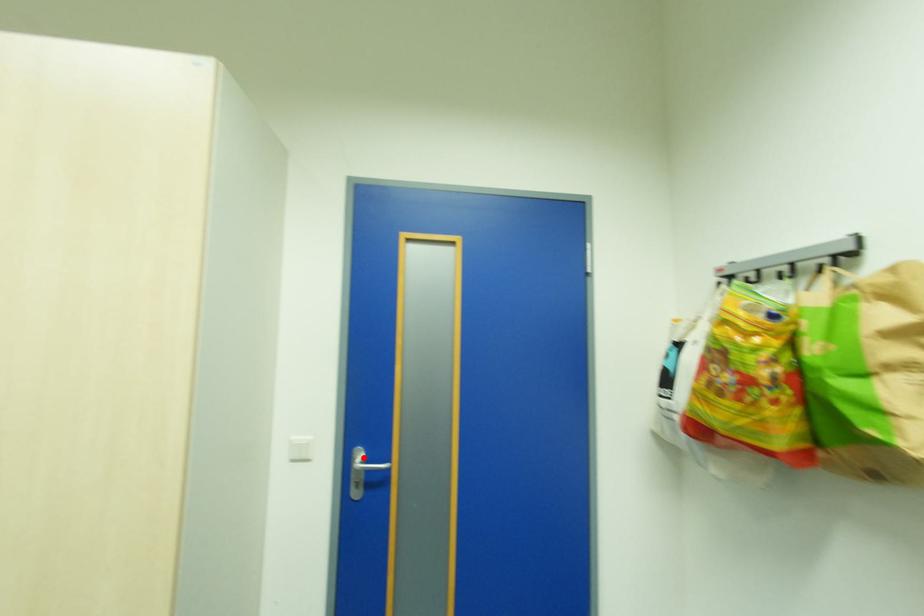
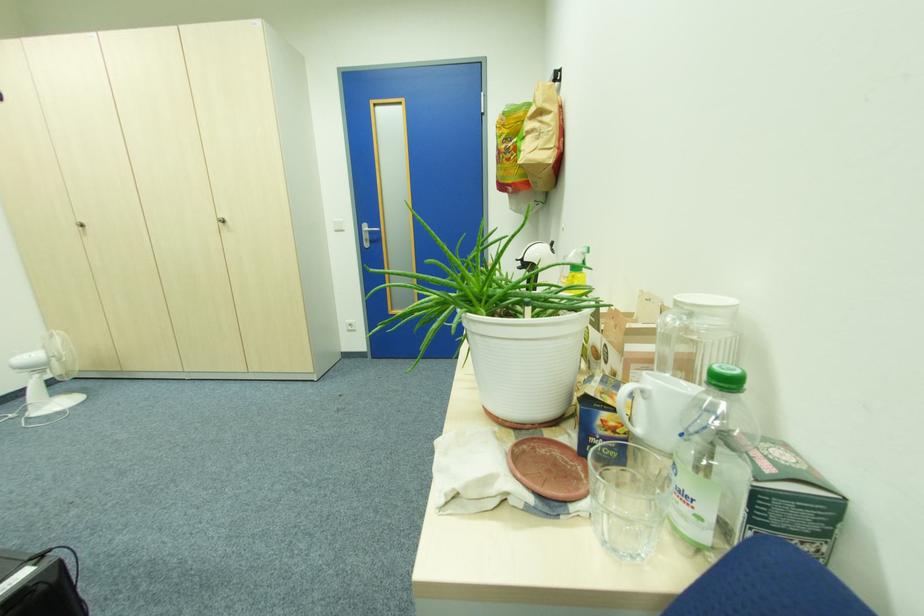
Question: I am providing you with two images of the same scene from different viewpoints. In image1, a red point is highlighted. Considering the same 3D point in image2, which of the following is correct?

Choices:
 (A) It is closer
 (B) It is farther

Answer: (A)